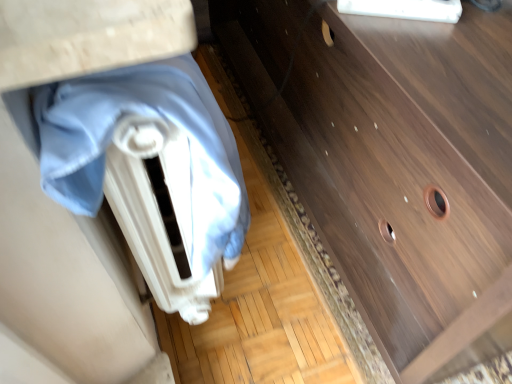
Question: Is dark wood chest of drawers at center inside the boundaries of wooden vanity at center, or outside?

Choices:
 (A) outside
 (B) inside

Answer: (A)

Question: From a real-world perspective, is dark wood chest of drawers at center positioned above or below wooden vanity at center?

Choices:
 (A) below
 (B) above

Answer: (A)

Question: Which object is positioned farthest from the dark wood chest of drawers at center?

Choices:
 (A) blue fabric at left
 (B) wooden vanity at center

Answer: (B)

Question: Which object is the farthest from the dark wood chest of drawers at center?

Choices:
 (A) blue fabric at left
 (B) wooden vanity at center

Answer: (B)